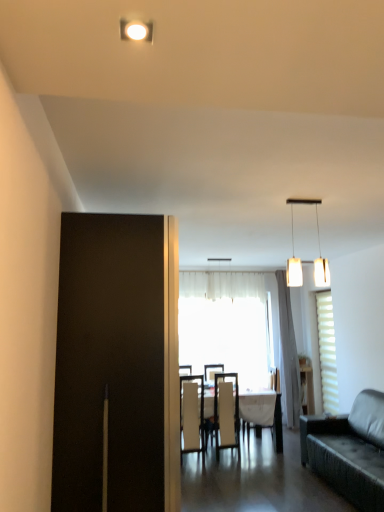
What is the approximate height of white leather chair at center, which appears as the 2th chair when viewed from the right?

The height of white leather chair at center, which appears as the 2th chair when viewed from the right, is 1.07 meters.

Find the location of a particular element. This screenshot has width=384, height=512. white fabric chair at center, arranged as the third chair when viewed from the right is located at coordinates (191, 414).

Describe the element at coordinates (191, 414) in the screenshot. I see `white fabric chair at center, the first chair from the left` at that location.

The image size is (384, 512). In order to click on white fabric chair at center, which is counted as the first chair, starting from the right in this screenshot , I will do [x=264, y=411].

What are the coordinates of `white matte pendant lights at upper center` in the screenshot? It's located at (306, 261).

Would you say translucent fabric window at center, positioned as the 2th window in right-to-left order, is inside or outside white textured blinds at right, marked as the 2th window in a left-to-right arrangement?

translucent fabric window at center, positioned as the 2th window in right-to-left order, is outside white textured blinds at right, marked as the 2th window in a left-to-right arrangement.

Find the location of a particular element. The image size is (384, 512). window in front of the translucent fabric window at center, arranged as the first window when viewed from the left is located at coordinates (327, 352).

Between translucent fabric window at center, arranged as the first window when viewed from the left, and white textured blinds at right, marked as the 2th window in a left-to-right arrangement, which one has larger size?

With larger size is translucent fabric window at center, arranged as the first window when viewed from the left.

Is white glossy table at center at the back of white leather chair at center, which is the second chair in left-to-right order?

Absolutely, white leather chair at center, which is the second chair in left-to-right order, is directed away from white glossy table at center.

How much distance is there between white leather chair at center, which appears as the 2th chair when viewed from the right, and white glossy table at center?

16.75 inches.

Identify the location of the 1st chair to the left of the white glossy table at center, starting your count from the anchor. This screenshot has height=512, width=384. (226, 412).

Which of these two, white leather chair at center, which is the second chair in left-to-right order, or white glossy table at center, is thinner?

white leather chair at center, which is the second chair in left-to-right order.

Can you confirm if white glossy table at center is bigger than white textured blinds at right, marked as the 2th window in a left-to-right arrangement?

Indeed, white glossy table at center has a larger size compared to white textured blinds at right, marked as the 2th window in a left-to-right arrangement.

Can you see white glossy table at center touching white textured blinds at right, which appears as the first window when viewed from the right?

No, white glossy table at center is not next to white textured blinds at right, which appears as the first window when viewed from the right.

Does white glossy table at center have a greater width compared to white textured blinds at right, which appears as the first window when viewed from the right?

Indeed, white glossy table at center has a greater width compared to white textured blinds at right, which appears as the first window when viewed from the right.

Do you think white glossy table at center is within white textured blinds at right, marked as the 2th window in a left-to-right arrangement, or outside of it?

white glossy table at center is located beyond the bounds of white textured blinds at right, marked as the 2th window in a left-to-right arrangement.

From the image's perspective, which one is positioned lower, white leather chair at center, which is the second chair in left-to-right order, or translucent fabric window at center, arranged as the first window when viewed from the left?

From the image's view, white leather chair at center, which is the second chair in left-to-right order, is below.

How many degrees apart are the facing directions of white leather chair at center, which is the second chair in left-to-right order, and translucent fabric window at center, positioned as the 2th window in right-to-left order?

The angular difference between white leather chair at center, which is the second chair in left-to-right order, and translucent fabric window at center, positioned as the 2th window in right-to-left order, is 5.1 degrees.

In the image, is white leather chair at center, which appears as the 2th chair when viewed from the right, positioned in front of or behind translucent fabric window at center, positioned as the 2th window in right-to-left order?

Clearly, white leather chair at center, which appears as the 2th chair when viewed from the right, is in front of translucent fabric window at center, positioned as the 2th window in right-to-left order.

Which point is more distant from viewer, (193,440) or (232,423)?

The point (232,423) is more distant.

Based on the photo, is white fabric chair at center, the first chair from the left, not close to white leather chair at center, which is the second chair in left-to-right order?

white fabric chair at center, the first chair from the left, is actually quite close to white leather chair at center, which is the second chair in left-to-right order.

Considering the relative sizes of white fabric chair at center, the first chair from the left, and white leather chair at center, which appears as the 2th chair when viewed from the right, in the image provided, is white fabric chair at center, the first chair from the left, thinner than white leather chair at center, which appears as the 2th chair when viewed from the right,?

Yes, white fabric chair at center, the first chair from the left, is thinner than white leather chair at center, which appears as the 2th chair when viewed from the right.

Who is more distant, white fabric chair at center, the first chair from the left, or white leather chair at center, which appears as the 2th chair when viewed from the right?

white leather chair at center, which appears as the 2th chair when viewed from the right.

Considering the sizes of white sheer curtain at center and white leather chair at center, which is the second chair in left-to-right order, in the image, is white sheer curtain at center wider or thinner than white leather chair at center, which is the second chair in left-to-right order,?

In the image, white sheer curtain at center appears to be more narrow than white leather chair at center, which is the second chair in left-to-right order.

Considering the points (288, 346) and (215, 382), which point is in front, point (288, 346) or point (215, 382)?

The point (215, 382) is more forward.

Is white sheer curtain at center positioned beyond the bounds of white leather chair at center, which is the second chair in left-to-right order?

That's correct, white sheer curtain at center is outside of white leather chair at center, which is the second chair in left-to-right order.

How much distance is there between white sheer curtain at center and white leather chair at center, which appears as the 2th chair when viewed from the right?

They are 3.58 feet apart.

Is white sheer curtain at center positioned far away from matte white cabinet at right?

No, there isn't a large distance between white sheer curtain at center and matte white cabinet at right.

Is white sheer curtain at center not within matte white cabinet at right?

white sheer curtain at center is positioned outside matte white cabinet at right.

Where is `curtain lying on the left of matte white cabinet at right`? The image size is (384, 512). curtain lying on the left of matte white cabinet at right is located at coordinates (288, 356).

From a real-world perspective, is white sheer curtain at center physically above matte white cabinet at right?

Yes, from a real-world perspective, white sheer curtain at center is on top of matte white cabinet at right.

The width and height of the screenshot is (384, 512). I want to click on window located on the right of translucent fabric window at center, positioned as the 2th window in right-to-left order, so click(x=327, y=352).

The image size is (384, 512). I want to click on the 1st chair to the left of the white glossy table at center, starting your count from the anchor, so click(226, 412).

Estimate the real-world distances between objects in this image. Which object is closer to matte white cabinet at right, translucent fabric window at center, positioned as the 2th window in right-to-left order, or white fabric chair at center, the first chair from the left?

translucent fabric window at center, positioned as the 2th window in right-to-left order, is positioned closer to the anchor matte white cabinet at right.

In the scene shown: Estimate the real-world distances between objects in this image. Which object is closer to matte white cabinet at right, translucent fabric window at center, arranged as the first window when viewed from the left, or white textured blinds at right, marked as the 2th window in a left-to-right arrangement?

white textured blinds at right, marked as the 2th window in a left-to-right arrangement, is closer to matte white cabinet at right.

Estimate the real-world distances between objects in this image. Which object is further from white leather chair at center, which appears as the 2th chair when viewed from the right, white sheer curtain at center or white fabric chair at center, which is counted as the first chair, starting from the right?

Based on the image, white sheer curtain at center appears to be further to white leather chair at center, which appears as the 2th chair when viewed from the right.

Looking at the image, which one is located closer to translucent fabric window at center, positioned as the 2th window in right-to-left order, white sheer curtain at center or white fabric chair at center, which is counted as the first chair, starting from the right?

white sheer curtain at center is closer to translucent fabric window at center, positioned as the 2th window in right-to-left order.

Estimate the real-world distances between objects in this image. Which object is further from white fabric chair at center, the first chair from the left, translucent fabric window at center, arranged as the first window when viewed from the left, or white fabric chair at center, acting as the 3th chair starting from the left?

Based on the image, translucent fabric window at center, arranged as the first window when viewed from the left, appears to be further to white fabric chair at center, the first chair from the left.

Looking at the image, which one is located closer to leather couch at right, translucent fabric window at center, arranged as the first window when viewed from the left, or white leather chair at center, which appears as the 2th chair when viewed from the right?

white leather chair at center, which appears as the 2th chair when viewed from the right, is positioned closer to the anchor leather couch at right.

Estimate the real-world distances between objects in this image. Which object is closer to white glossy table at center, white sheer curtain at center or white fabric chair at center, acting as the 3th chair starting from the left?

white fabric chair at center, acting as the 3th chair starting from the left, is positioned closer to the anchor white glossy table at center.

Based on their spatial positions, is white fabric chair at center, the first chair from the left, or matte white cabinet at right further from white textured blinds at right, which appears as the first window when viewed from the right?

white fabric chair at center, the first chair from the left, is further to white textured blinds at right, which appears as the first window when viewed from the right.

I want to click on studio couch between white matte pendant lights at upper center and translucent fabric window at center, arranged as the first window when viewed from the left, in the front-back direction, so click(x=349, y=450).

Find the location of `curtain located between white fabric chair at center, which is counted as the first chair, starting from the right, and translucent fabric window at center, positioned as the 2th window in right-to-left order, in the depth direction`. curtain located between white fabric chair at center, which is counted as the first chair, starting from the right, and translucent fabric window at center, positioned as the 2th window in right-to-left order, in the depth direction is located at coordinates (288, 356).

Locate an element on the screen. The height and width of the screenshot is (512, 384). window between leather couch at right and white sheer curtain at center along the z-axis is located at coordinates (327, 352).

Identify the location of kitchen & dining room table between white matte pendant lights at upper center and translucent fabric window at center, arranged as the first window when viewed from the left, along the z-axis. (263, 413).